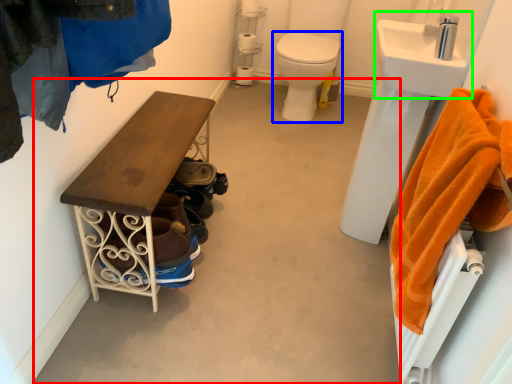
Question: Considering the real-world distances, which object is farthest from concrete (highlighted by a red box)? toilet (highlighted by a blue box) or sink (highlighted by a green box)?

Choices:
 (A) toilet
 (B) sink

Answer: (A)